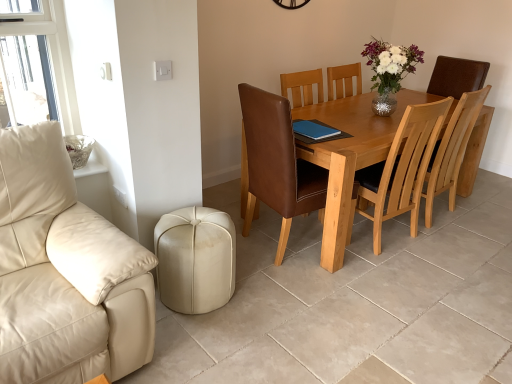
I want to click on free space between light brown wood chair at center, which ranks as the second chair in left-to-right order, and light brown wooden table at center, so click(x=413, y=236).